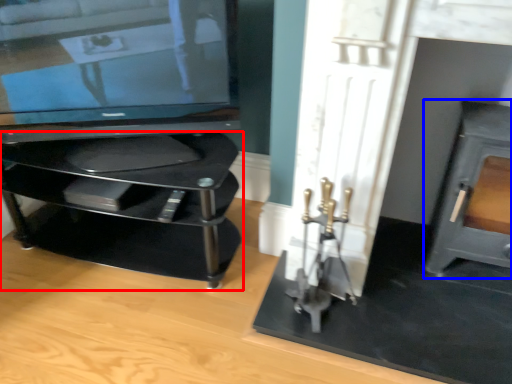
Question: Which object appears farthest to the camera in this image, furniture (highlighted by a red box) or fireplace (highlighted by a blue box)?

Choices:
 (A) furniture
 (B) fireplace

Answer: (A)